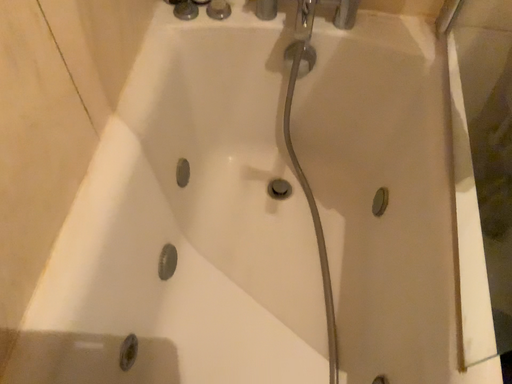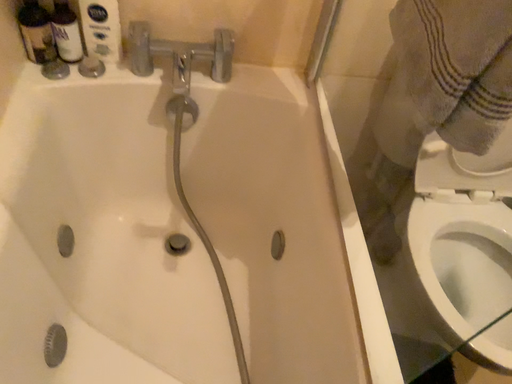
Question: Which way did the camera rotate in the video?

Choices:
 (A) rotated downward
 (B) rotated upward

Answer: (B)